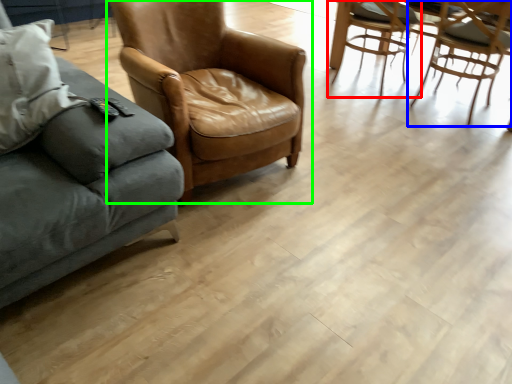
Question: Which is farther away from chair (highlighted by a red box)? chair (highlighted by a blue box) or chair (highlighted by a green box)?

Choices:
 (A) chair
 (B) chair

Answer: (B)